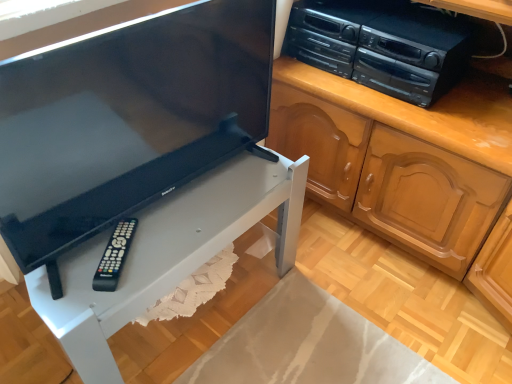
Locate an element on the screen. matte black television at center is located at coordinates coord(127,119).

Locate an element on the screen. white matte table at lower left is located at coordinates (167, 254).

Locate an element on the screen. This screenshot has width=512, height=384. matte black television at center is located at coordinates (127, 119).

Is black plastic remote at lower left further to camera compared to black plastic stereo at upper right?

No, black plastic remote at lower left is closer to the viewer.

Is black plastic remote at lower left outside of black plastic stereo at upper right?

Absolutely, black plastic remote at lower left is external to black plastic stereo at upper right.

From the image's perspective, which one is positioned higher, black plastic remote at lower left or black plastic stereo at upper right?

black plastic stereo at upper right appears higher in the image.

From a real-world perspective, which is physically above, black plastic remote at lower left or black plastic stereo at upper right?

From a 3D spatial view, black plastic stereo at upper right is above.

Which object is positioned more to the right, black plastic remote at lower left or white matte table at lower left?

From the viewer's perspective, white matte table at lower left appears more on the right side.

Can you confirm if black plastic remote at lower left is shorter than white matte table at lower left?

Indeed, black plastic remote at lower left has a lesser height compared to white matte table at lower left.

Would you say white matte table at lower left is part of black plastic remote at lower left's contents?

That's incorrect, white matte table at lower left is not inside black plastic remote at lower left.

Looking at the image, does black plastic remote at lower left seem bigger or smaller compared to white matte table at lower left?

In the image, black plastic remote at lower left appears to be smaller than white matte table at lower left.

Which of these two, white matte table at lower left or black plastic remote at lower left, stands shorter?

Standing shorter between the two is black plastic remote at lower left.

Image resolution: width=512 pixels, height=384 pixels. What are the coordinates of `remote above the white matte table at lower left (from the image's perspective)` in the screenshot? It's located at (114, 256).

Could you tell me if white matte table at lower left is turned towards black plastic remote at lower left?

No.

Considering the relative sizes of white matte table at lower left and black plastic remote at lower left in the image provided, is white matte table at lower left smaller than black plastic remote at lower left?

Incorrect, white matte table at lower left is not smaller in size than black plastic remote at lower left.

How much distance is there between matte black television at center and white matte table at lower left?

matte black television at center and white matte table at lower left are 8.06 inches apart from each other.

Based on the photo, is matte black television at center oriented towards white matte table at lower left?

No.

Is matte black television at center next to white matte table at lower left?

No, matte black television at center is not in contact with white matte table at lower left.

Find the location of a particular element. The height and width of the screenshot is (384, 512). television in front of the white matte table at lower left is located at coordinates (127, 119).

Between white matte table at lower left and matte black television at center, which one has larger width?

With larger width is white matte table at lower left.

Is point (63, 264) farther from camera compared to point (131, 40)?

Yes, point (63, 264) is behind point (131, 40).

Choose the correct answer: Is white matte table at lower left inside matte black television at center or outside it?

white matte table at lower left is not inside matte black television at center, it's outside.

Would you say black plastic remote at lower left is outside matte black television at center?

No, black plastic remote at lower left is not entirely external to matte black television at center.

In the scene shown: Considering the sizes of objects black plastic remote at lower left and matte black television at center in the image provided, who is bigger, black plastic remote at lower left or matte black television at center?

matte black television at center.

Which object is closer to the camera, black plastic remote at lower left or matte black television at center?

Positioned in front is matte black television at center.

Does black plastic stereo at upper right appear on the right side of black plastic remote at lower left?

Correct, you'll find black plastic stereo at upper right to the right of black plastic remote at lower left.

What are the coordinates of `home appliance above the black plastic remote at lower left (from the image's perspective)` in the screenshot? It's located at (381, 45).

What's the angular difference between black plastic stereo at upper right and black plastic remote at lower left's facing directions?

The facing directions of black plastic stereo at upper right and black plastic remote at lower left are 39.2 degrees apart.

Is the depth of black plastic stereo at upper right less than that of black plastic remote at lower left?

No, the depth of black plastic stereo at upper right is greater than that of black plastic remote at lower left.

The width and height of the screenshot is (512, 384). In the image, there is a black plastic stereo at upper right. What are the coordinates of `remote below it (from a real-world perspective)` in the screenshot? It's located at (114, 256).

Where is `remote that is behind the white matte table at lower left`? remote that is behind the white matte table at lower left is located at coordinates (114, 256).

When comparing their distances from black plastic remote at lower left, does black plastic stereo at upper right or matte black television at center seem further?

black plastic stereo at upper right lies further to black plastic remote at lower left than the other object.

Looking at the image, which one is located closer to black plastic remote at lower left, black plastic stereo at upper right or white matte table at lower left?

white matte table at lower left is closer to black plastic remote at lower left.

Looking at this image, which object lies nearer to the anchor point white matte table at lower left, black plastic remote at lower left or matte black television at center?

black plastic remote at lower left.

Which object lies further to the anchor point black plastic stereo at upper right, black plastic remote at lower left or matte black television at center?

black plastic remote at lower left.

Which object lies further to the anchor point black plastic stereo at upper right, black plastic remote at lower left or white matte table at lower left?

black plastic remote at lower left lies further to black plastic stereo at upper right than the other object.

Which object lies nearer to the anchor point black plastic stereo at upper right, matte black television at center or black plastic remote at lower left?

The object closer to black plastic stereo at upper right is matte black television at center.

When comparing their distances from matte black television at center, does white matte table at lower left or black plastic stereo at upper right seem further?

Based on the image, black plastic stereo at upper right appears to be further to matte black television at center.

Based on their spatial positions, is matte black television at center or black plastic stereo at upper right closer to white matte table at lower left?

Among the two, matte black television at center is located nearer to white matte table at lower left.

Find the location of a particular element. Image resolution: width=512 pixels, height=384 pixels. table between black plastic remote at lower left and black plastic stereo at upper right in the horizontal direction is located at coordinates (167, 254).

I want to click on table positioned between matte black television at center and black plastic remote at lower left from near to far, so click(167, 254).

Image resolution: width=512 pixels, height=384 pixels. In order to click on television between black plastic remote at lower left and black plastic stereo at upper right in the horizontal direction in this screenshot , I will do `click(127, 119)`.

The height and width of the screenshot is (384, 512). What are the coordinates of `television situated between white matte table at lower left and black plastic stereo at upper right from left to right` in the screenshot? It's located at (127, 119).